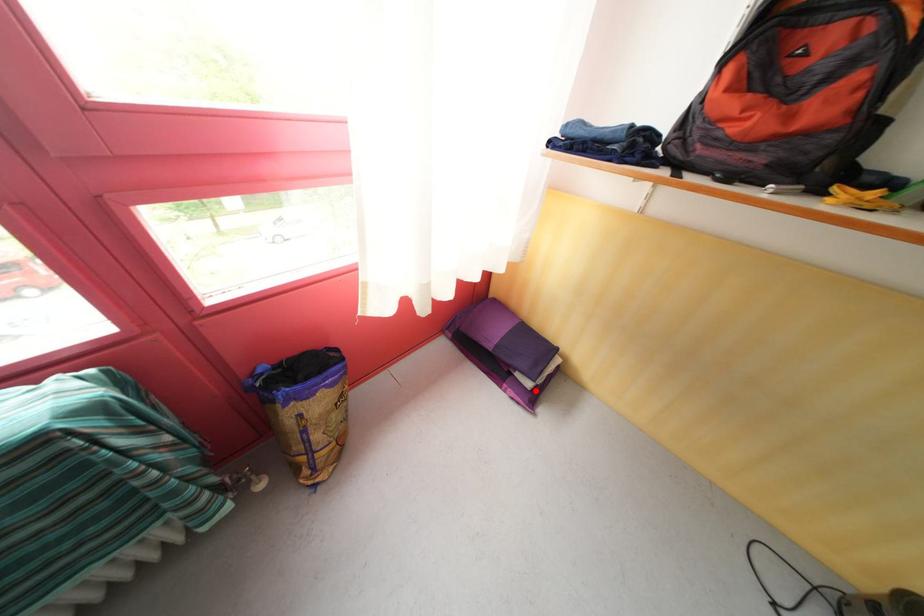
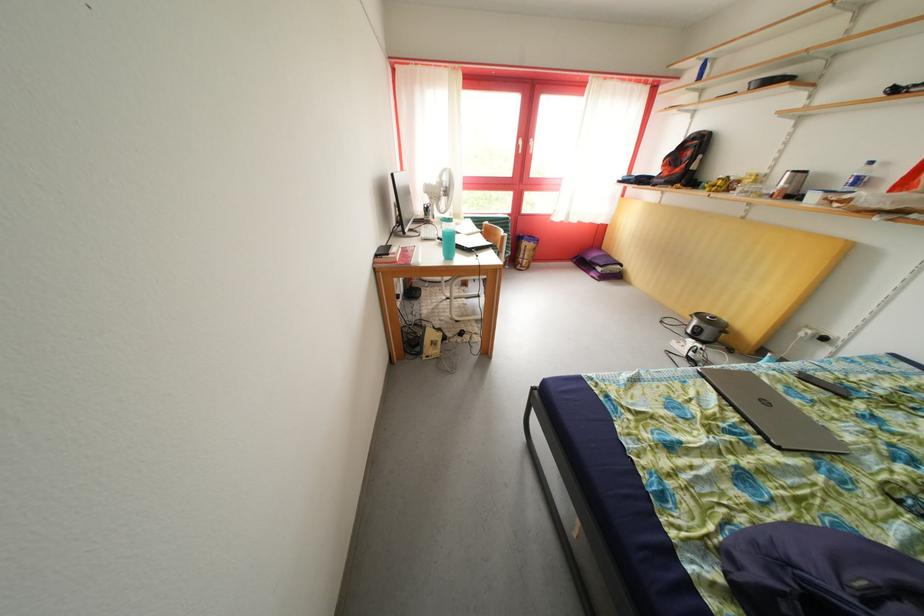
Where in the second image is the point corresponding to the highlighted location from the first image?

(608, 275)